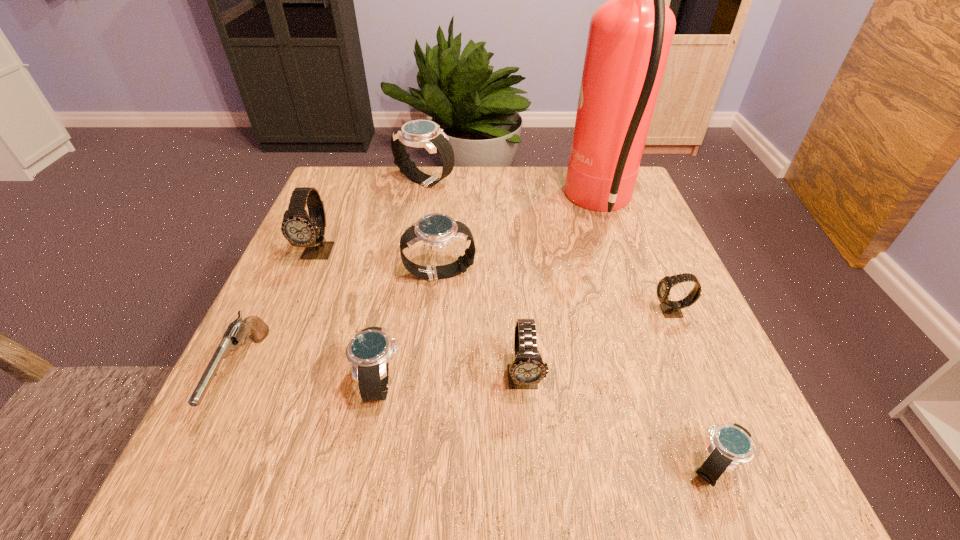
Choose which object is the seventh nearest neighbor to the fifth farthest object. Please provide its 2D coordinates. Your answer should be formatted as a tuple, i.e. [(x, y)], where the tuple contains the x and y coordinates of a point satisfying the conditions above.

[(300, 229)]

The image size is (960, 540). What are the coordinates of `the second closest object to the gun` in the screenshot? It's located at (369, 351).

Point out which watch is positioned as the fourth nearest to the third biggest silver watch. Please provide its 2D coordinates. Your answer should be formatted as a tuple, i.e. [(x, y)], where the tuple contains the x and y coordinates of a point satisfying the conditions above.

[(731, 444)]

I want to click on the sixth closest watch to the biggest silver watch, so click(x=731, y=444).

Locate which silver watch ranks second in proximity to the nearest gray watch. Please provide its 2D coordinates. Your answer should be formatted as a tuple, i.e. [(x, y)], where the tuple contains the x and y coordinates of a point satisfying the conditions above.

[(369, 351)]

The image size is (960, 540). Identify the location of silver watch that can be found as the second closest to the third smallest silver watch. (418, 133).

Select which gray watch appears as the third closest to the biggest silver watch. Please provide its 2D coordinates. Your answer should be formatted as a tuple, i.e. [(x, y)], where the tuple contains the x and y coordinates of a point satisfying the conditions above.

[(671, 309)]

Select which gray watch appears as the second closest to the second biggest silver watch. Please provide its 2D coordinates. Your answer should be formatted as a tuple, i.e. [(x, y)], where the tuple contains the x and y coordinates of a point satisfying the conditions above.

[(527, 370)]

In order to click on vacant area in the image that satisfies the following two spatial constraints: 1. towards the nozzle of the tallest object; 2. aiming along the barrel of the gun in this screenshot , I will do `click(662, 374)`.

You are a GUI agent. You are given a task and a screenshot of the screen. Output one action in this format:
    pyautogui.click(x=<x>, y=<y>)
    Task: Click on the blank space that satisfies the following two spatial constraints: 1. on the face of the fourth object from right to left; 2. on the right side of the nearest watch
    
    Given the screenshot: What is the action you would take?
    pyautogui.click(x=531, y=467)